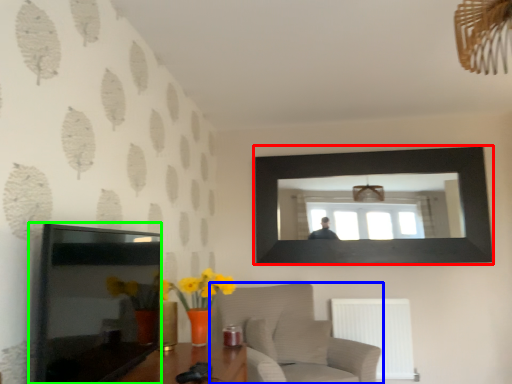
Question: Estimate the real-world distances between objects in this image. Which object is farther from picture frame (highlighted by a red box), furniture (highlighted by a blue box) or picture frame (highlighted by a green box)?

Choices:
 (A) furniture
 (B) picture frame

Answer: (B)